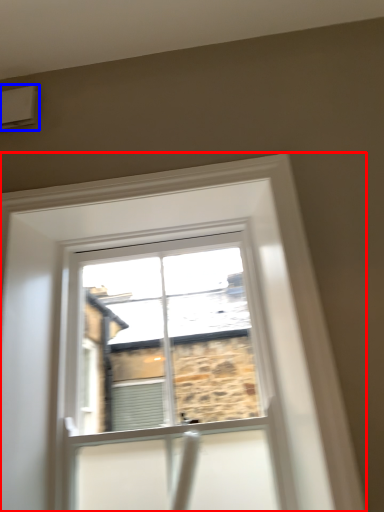
Question: Which object appears closest to the camera in this image, window (highlighted by a red box) or air conditioning (highlighted by a blue box)?

Choices:
 (A) window
 (B) air conditioning

Answer: (A)